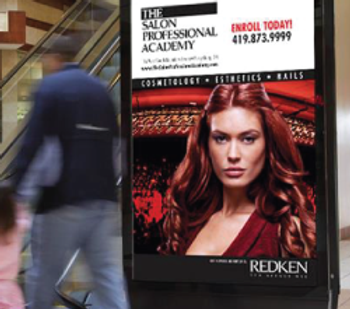
Where is `wall`? This screenshot has height=309, width=350. wall is located at coordinates (28, 36).